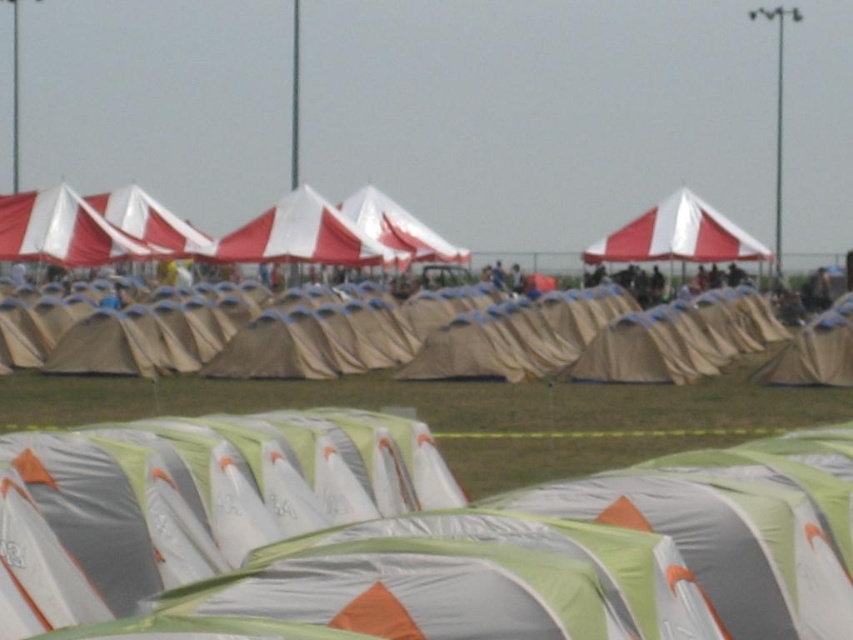
Question: Which point is closer to the camera taking this photo?

Choices:
 (A) (647, 236)
 (B) (430, 252)
 (C) (505, 371)

Answer: (C)

Question: Is white/red striped canopy at upper left below red/white striped canopy at upper center?

Choices:
 (A) no
 (B) yes

Answer: (B)

Question: Which object is closer to the camera taking this photo?

Choices:
 (A) beige canvas tent at center
 (B) red/white striped canopy at upper center
 (C) green fabric tent at center

Answer: (C)

Question: Estimate the real-world distances between objects in this image. Which object is closer to the red/white striped canopy at upper center?

Choices:
 (A) white fabric canopy at center
 (B) beige canvas tent at center
 (C) white/red striped canopy at upper left
 (D) green fabric tent at center

Answer: (A)

Question: Does green fabric tent at center have a lesser width compared to white/red striped canopy at upper left?

Choices:
 (A) yes
 (B) no

Answer: (B)

Question: Does green fabric tent at center appear on the right side of red/white striped canopy at upper center?

Choices:
 (A) yes
 (B) no

Answer: (B)